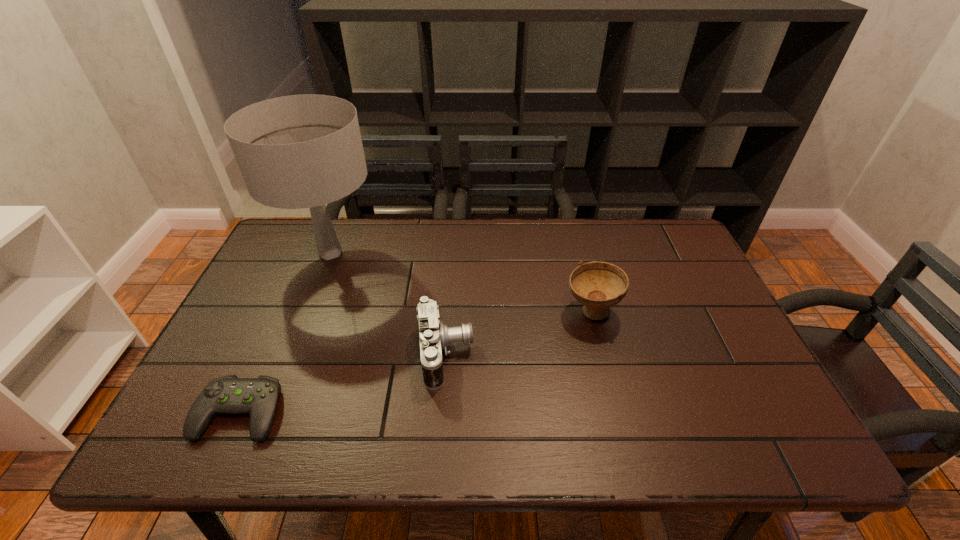
Locate an element on the screen. The height and width of the screenshot is (540, 960). vacant area at the far right corner of the desktop is located at coordinates (644, 255).

Locate an element on the screen. free space between the control and the tallest object is located at coordinates (285, 333).

Where is `free space between the rightmost object and the control`? The height and width of the screenshot is (540, 960). free space between the rightmost object and the control is located at coordinates (416, 362).

What are the coordinates of `vacant space in between the shortest object and the farthest object` in the screenshot? It's located at 285,333.

Locate an element on the screen. This screenshot has width=960, height=540. vacant space that is in between the rightmost object and the control is located at coordinates (x=416, y=362).

I want to click on blank region between the rightmost object and the lampshade, so click(461, 282).

I want to click on free space between the shortest object and the second object from right to left, so click(343, 383).

I want to click on free point between the tallest object and the shortest object, so click(285, 333).

Identify the location of blank region between the farthest object and the second object from right to left. This screenshot has height=540, width=960. (388, 303).

I want to click on vacant space that is in between the farthest object and the rightmost object, so click(x=461, y=282).